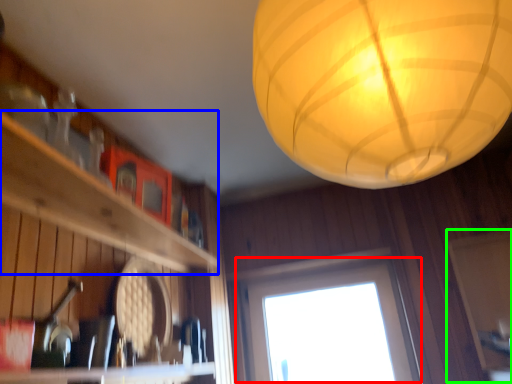
Question: Which object is positioned farthest from window (highlighted by a red box)? Select from shelf (highlighted by a blue box) and screen door (highlighted by a green box).

Choices:
 (A) shelf
 (B) screen door

Answer: (A)